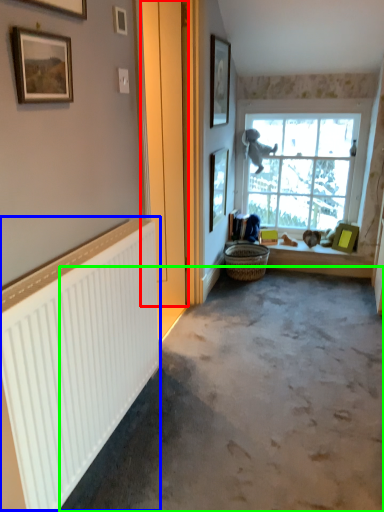
Question: Considering the real-world distances, which object is closest to door (highlighted by a red box)? radiator (highlighted by a blue box) or concrete (highlighted by a green box).

Choices:
 (A) radiator
 (B) concrete

Answer: (B)